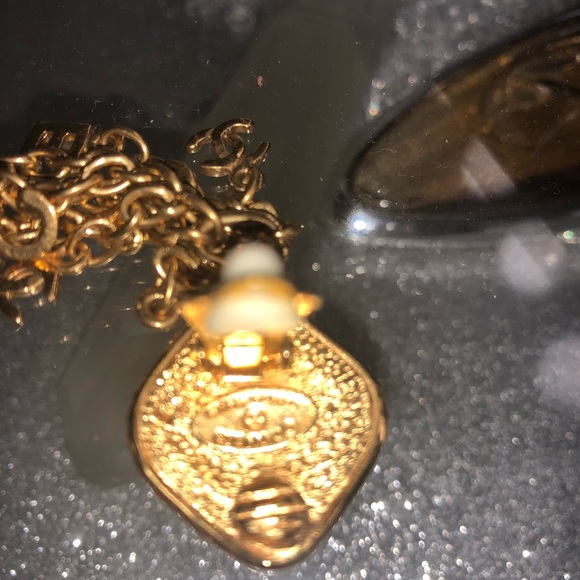
You are a GUI agent. You are given a task and a screenshot of the screen. Output one action in this format:
    pyautogui.click(x=<x>, y=<y>)
    Task: Click on the gold pendant
    The image size is (580, 580).
    Given the screenshot: What is the action you would take?
    pyautogui.click(x=266, y=418)